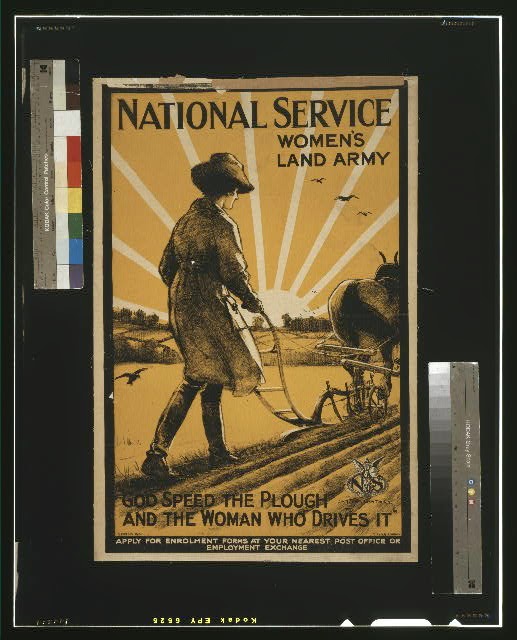
Find the location of `black matting`. black matting is located at coordinates (468, 300), (60, 397), (239, 577), (260, 44).